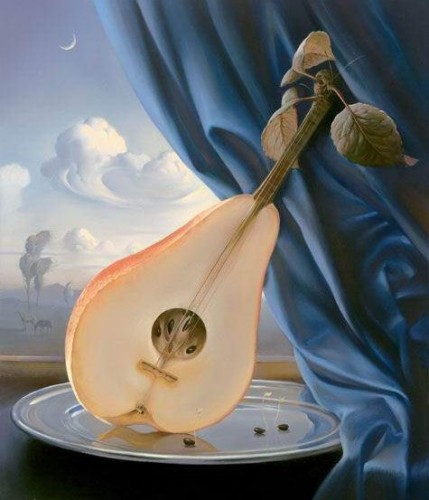
Where is `blue billowy curtain to the right of pear guitar`? The height and width of the screenshot is (500, 429). blue billowy curtain to the right of pear guitar is located at coordinates (151, 67), (212, 59), (281, 36), (355, 26), (305, 209), (386, 194), (301, 312), (387, 259), (357, 378), (378, 445).